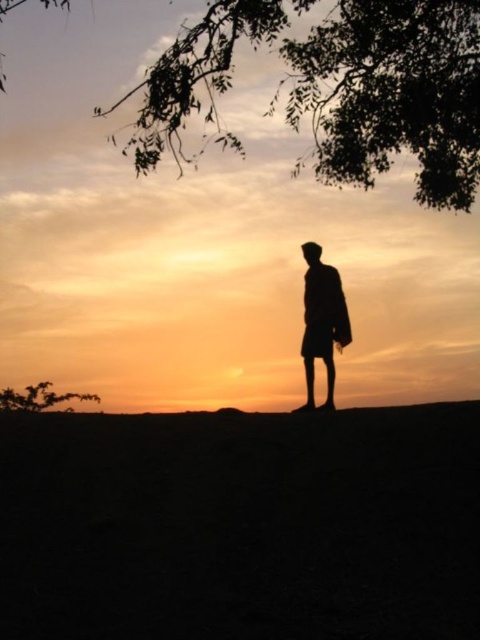
You are a photographer planning to take a sunset silhouette photo. You have a camera with a lens that can focus on objects up to 5 meters away. You see the matte black person at center and the green leafy tree at lower left in your frame. Can you focus on both subjects clearly?

The matte black person at center is 4.31 meters from the green leafy tree at lower left. Since the distance between them is within the camera lens range of 5 meters, you can focus on both subjects clearly.

You are an artist trying to sketch the sunset scene. You want to ensure the silhouette leafy branch at upper center and the green leafy tree at lower left are proportionally accurate. Which object should you draw wider?

The green leafy tree at lower left should be drawn wider since the silhouette leafy branch at upper center has a lesser width compared to it.

You are standing at the point labeled point (458, 445) and want to walk towards the horizon where the sun is setting. Is the point labeled point (11, 397) located in front of or behind you as you face the sunset?

The point labeled point (11, 397) is located behind you because point (458, 445) is closer to the viewer than point (11, 397), meaning the latter is further away from the viewer and thus behind when facing the horizon.